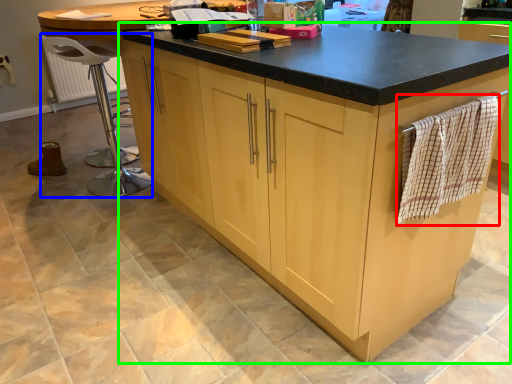
Question: Considering the real-world distances, which object is closest to blanket (highlighted by a red box)? bar stool (highlighted by a blue box) or cabinetry (highlighted by a green box).

Choices:
 (A) bar stool
 (B) cabinetry

Answer: (B)